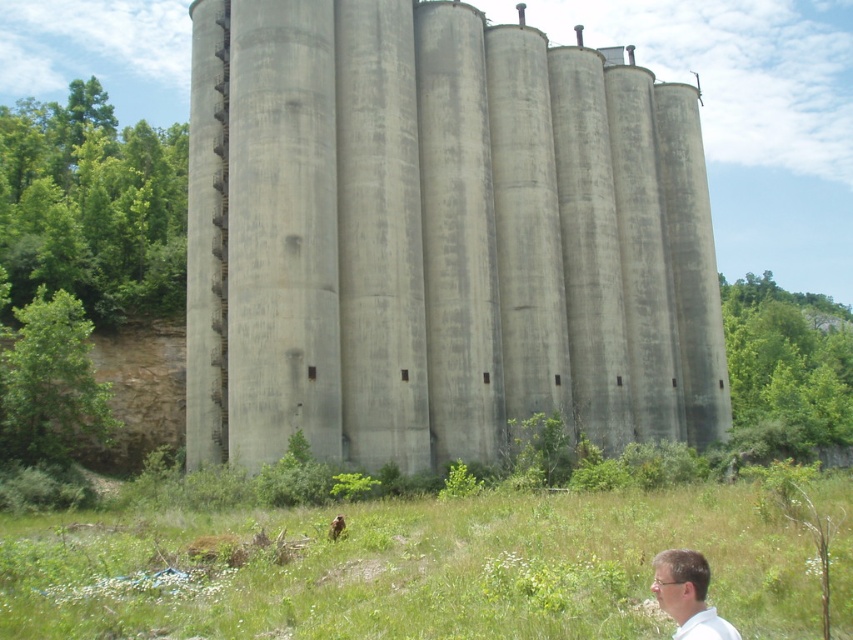
Question: Observing the image, what is the correct spatial positioning of gray concrete silo at center in reference to white matte shirt at lower right?

Choices:
 (A) above
 (B) below

Answer: (A)

Question: Observing the image, what is the correct spatial positioning of gray concrete silo at center in reference to green grass at lower center?

Choices:
 (A) right
 (B) left

Answer: (A)

Question: Which of these objects is positioned closest to the gray concrete silo at center?

Choices:
 (A) green grass at lower center
 (B) white matte shirt at lower right

Answer: (A)

Question: Is gray concrete silo at center smaller than white matte shirt at lower right?

Choices:
 (A) yes
 (B) no

Answer: (B)

Question: Which of the following is the closest to the observer?

Choices:
 (A) (409, 618)
 (B) (717, 632)
 (C) (575, 211)

Answer: (B)

Question: Which is nearer to the gray concrete silo at center?

Choices:
 (A) white matte shirt at lower right
 (B) green grass at lower center

Answer: (B)